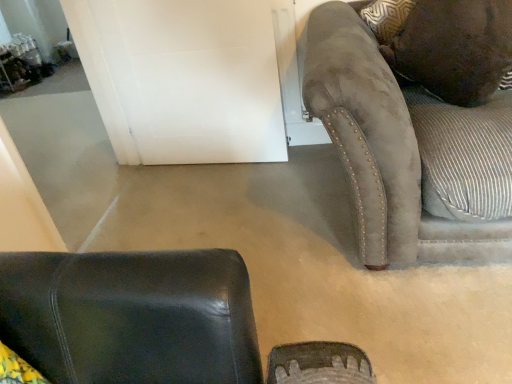
Question: From the image's perspective, is white matte door at upper center positioned above or below brown suede pillow at upper right?

Choices:
 (A) above
 (B) below

Answer: (A)

Question: Relative to brown suede pillow at upper right, is white matte door at upper center in front or behind?

Choices:
 (A) front
 (B) behind

Answer: (B)

Question: Estimate the real-world distances between objects in this image. Which object is closer to the white matte door at upper center?

Choices:
 (A) brown suede pillow at upper right
 (B) suede couch at right

Answer: (B)

Question: Estimate the real-world distances between objects in this image. Which object is farther from the suede couch at right?

Choices:
 (A) white matte door at upper center
 (B) brown suede pillow at upper right

Answer: (A)